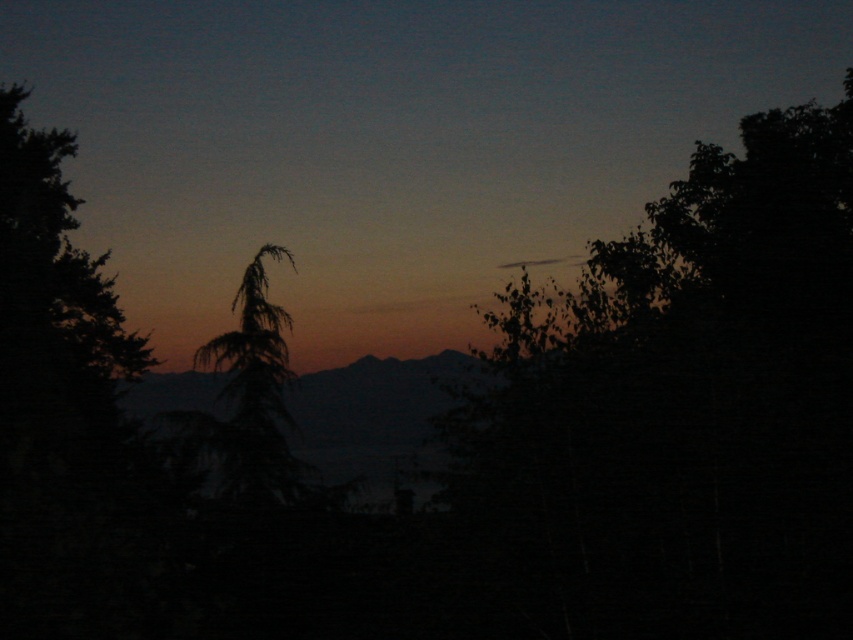
You are standing at the center of the scene looking towards the horizon. There is a point marked at coordinates point (682, 412). Which object does this point correspond to?

The point (682, 412) corresponds to the silhouette leafy tree at right.

You are standing in the twilight scene and want to take a photo. There are two points marked in the image, point 1 at coordinates point [849,81] and point 2 at coordinates point [279,412]. Which point is closer to your camera lens?

Point [279,412] is closer to the camera lens because it is less further away than point [849,81].

Looking at this image, you are a hiker who wants to set up a tent between the silhouette leafy tree at right and the silhouette coniferous tree at center. The tent requires at least 3 meters of space. Can you fit the tent between them?

The silhouette leafy tree at right is 3.46 meters from the silhouette coniferous tree at center, so yes, the tent can be placed between them as the distance is sufficient.